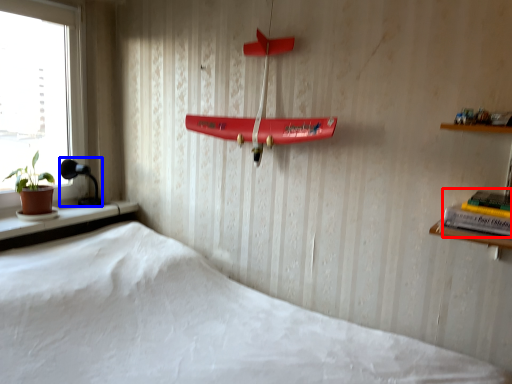
Question: Which object appears closest to the camera in this image, book (highlighted by a red box) or lamp (highlighted by a blue box)?

Choices:
 (A) book
 (B) lamp

Answer: (A)